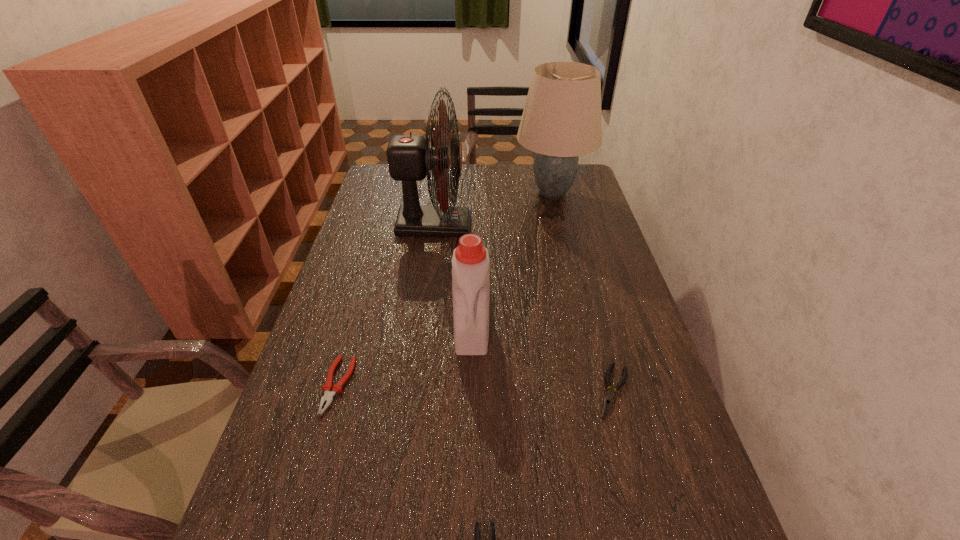
Image resolution: width=960 pixels, height=540 pixels. I want to click on free space between the lampshade and the leftmost pliers, so click(x=445, y=289).

Identify the location of unoccupied area between the rightmost pliers and the fan. The height and width of the screenshot is (540, 960). (524, 308).

At what (x,y) coordinates should I click in order to perform the action: click on vacant area that lies between the fan and the leftmost pliers. Please return your answer as a coordinate pair (x, y). Looking at the image, I should click on (386, 305).

Where is `unoccupied position between the rightmost pliers and the lampshade`? The height and width of the screenshot is (540, 960). unoccupied position between the rightmost pliers and the lampshade is located at coordinates (583, 292).

At what (x,y) coordinates should I click in order to perform the action: click on vacant region between the fan and the leftmost pliers. Please return your answer as a coordinate pair (x, y). Looking at the image, I should click on (386, 305).

Identify the location of free space between the leftmost object and the fan. Image resolution: width=960 pixels, height=540 pixels. (386, 305).

Where is `vacant space that's between the third tallest object and the leftmost pliers`? The image size is (960, 540). vacant space that's between the third tallest object and the leftmost pliers is located at coordinates (405, 357).

Select which object appears as the closest to the fan. Please provide its 2D coordinates. Your answer should be formatted as a tuple, i.e. [(x, y)], where the tuple contains the x and y coordinates of a point satisfying the conditions above.

[(561, 120)]

Identify which object is the fifth closest to the rightmost pliers. Please provide its 2D coordinates. Your answer should be formatted as a tuple, i.e. [(x, y)], where the tuple contains the x and y coordinates of a point satisfying the conditions above.

[(561, 120)]

The height and width of the screenshot is (540, 960). Find the location of `pliers that is the closest to the rightmost pliers`. pliers that is the closest to the rightmost pliers is located at coordinates (492, 528).